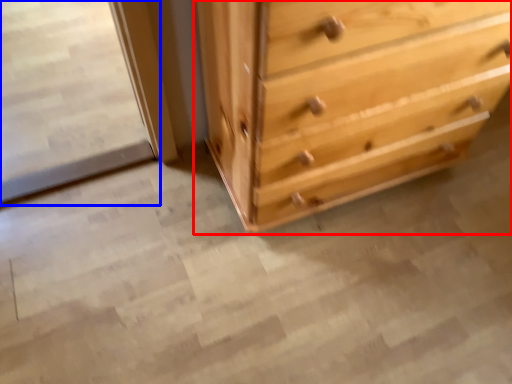
Question: Among these objects, which one is nearest to the camera, chest of drawers (highlighted by a red box) or screen door (highlighted by a blue box)?

Choices:
 (A) chest of drawers
 (B) screen door

Answer: (A)